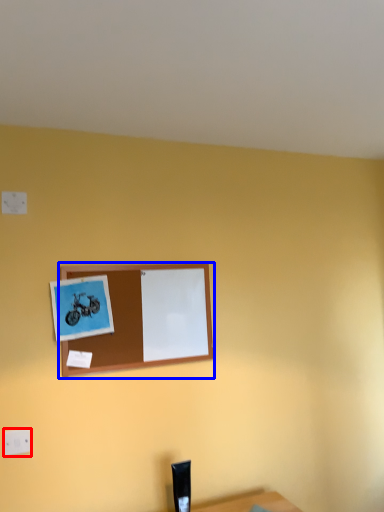
Question: Which point is further to the camera, electric outlet (highlighted by a red box) or picture frame (highlighted by a blue box)?

Choices:
 (A) electric outlet
 (B) picture frame

Answer: (B)